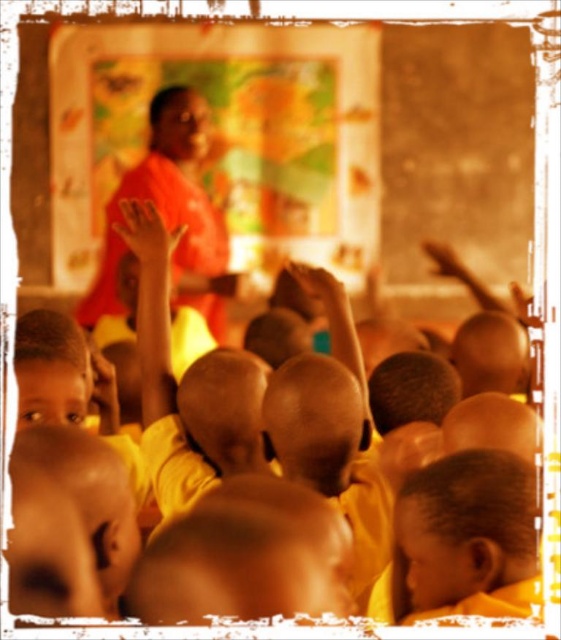
Question: Is yellow matte shirt at center wider than smooth skin hand at upper right?

Choices:
 (A) yes
 (B) no

Answer: (A)

Question: Which object is the farthest from the smooth skin hand at center?

Choices:
 (A) matte orange hand at upper left
 (B) yellow matte shirt at center
 (C) smooth skin hand at upper right

Answer: (C)

Question: Is yellow matte shirt at center wider than smooth yellow shirt at lower right?

Choices:
 (A) no
 (B) yes

Answer: (B)

Question: Which point appears farthest from the camera in this image?

Choices:
 (A) (154, 140)
 (B) (148, 253)

Answer: (A)

Question: Which point appears farthest from the camera in this image?

Choices:
 (A) (302, 262)
 (B) (360, 435)

Answer: (A)

Question: From the image, what is the correct spatial relationship of smooth yellow shirt at lower right in relation to smooth skin hand at upper right?

Choices:
 (A) above
 (B) below

Answer: (B)